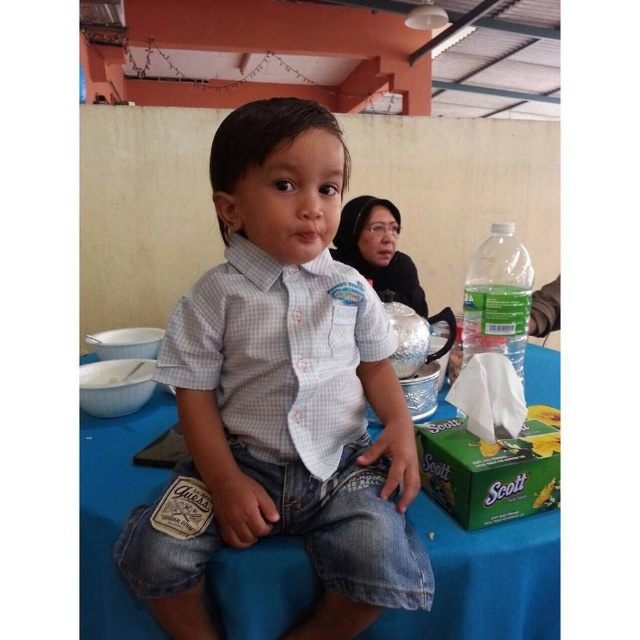
Question: Is light blue checkered shirt at center to the right of clear plastic bottle at right from the viewer's perspective?

Choices:
 (A) no
 (B) yes

Answer: (A)

Question: Which object is positioned farthest from the light blue checkered shirt at center?

Choices:
 (A) blue fabric table at center
 (B) clear plastic bottle at right

Answer: (B)

Question: Is blue fabric table at center bigger than clear plastic bottle at right?

Choices:
 (A) yes
 (B) no

Answer: (A)

Question: Estimate the real-world distances between objects in this image. Which object is closer to the clear plastic bottle at right?

Choices:
 (A) light blue checkered shirt at center
 (B) blue fabric table at center

Answer: (B)

Question: Considering the relative positions of light blue checkered shirt at center and blue fabric table at center in the image provided, where is light blue checkered shirt at center located with respect to blue fabric table at center?

Choices:
 (A) right
 (B) left

Answer: (B)

Question: Which point appears closest to the camera in this image?

Choices:
 (A) (508, 324)
 (B) (198, 374)

Answer: (B)